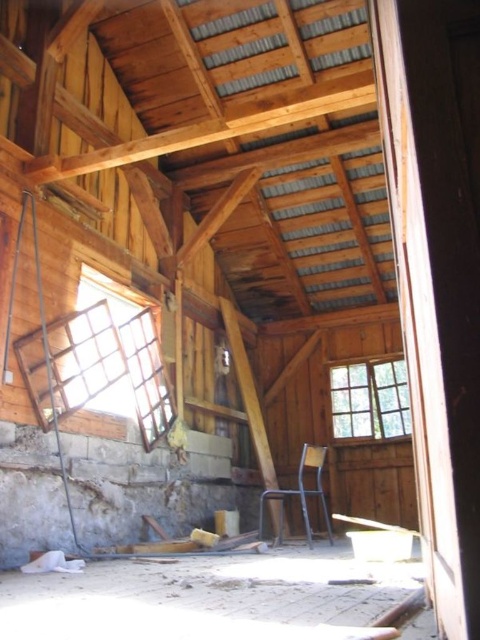
Who is higher up, clear glass window at upper left or clear glass window at right?

clear glass window at upper left is above.

Which is in front, point (164, 372) or point (402, 374)?

Point (164, 372) is in front.

Where is `clear glass window at upper left`? clear glass window at upper left is located at coordinates (110, 362).

Does clear glass window at upper left have a greater height compared to metallic chair at center?

Correct, clear glass window at upper left is much taller as metallic chair at center.

Is clear glass window at upper left below metallic chair at center?

Actually, clear glass window at upper left is above metallic chair at center.

This screenshot has width=480, height=640. Identify the location of clear glass window at upper left. (110, 362).

Is clear glass window at right to the right of metallic chair at center from the viewer's perspective?

Indeed, clear glass window at right is positioned on the right side of metallic chair at center.

Between clear glass window at right and metallic chair at center, which one has less height?

clear glass window at right is shorter.

The image size is (480, 640). What do you see at coordinates (370, 400) in the screenshot?
I see `clear glass window at right` at bounding box center [370, 400].

Find the location of a particular element. clear glass window at right is located at coordinates (370, 400).